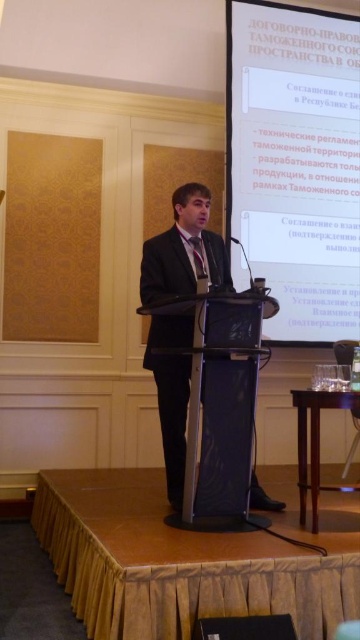
Is white glossy projection screen at upper center bigger than black suit at center?

Yes.

Identify the location of white glossy projection screen at upper center. The height and width of the screenshot is (640, 360). (295, 161).

Where is `white glossy projection screen at upper center`? The height and width of the screenshot is (640, 360). white glossy projection screen at upper center is located at coordinates (295, 161).